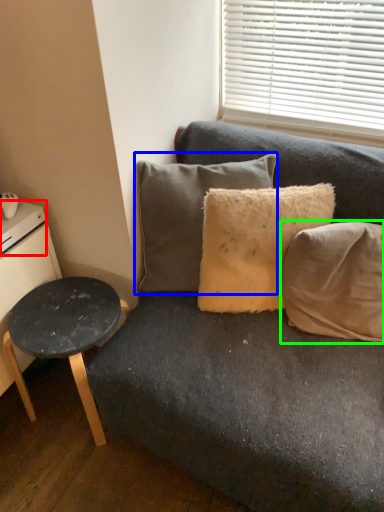
Question: Which object is positioned farthest from drawer (highlighted by a red box)? Select from pillow (highlighted by a blue box) and pillow (highlighted by a green box).

Choices:
 (A) pillow
 (B) pillow

Answer: (B)